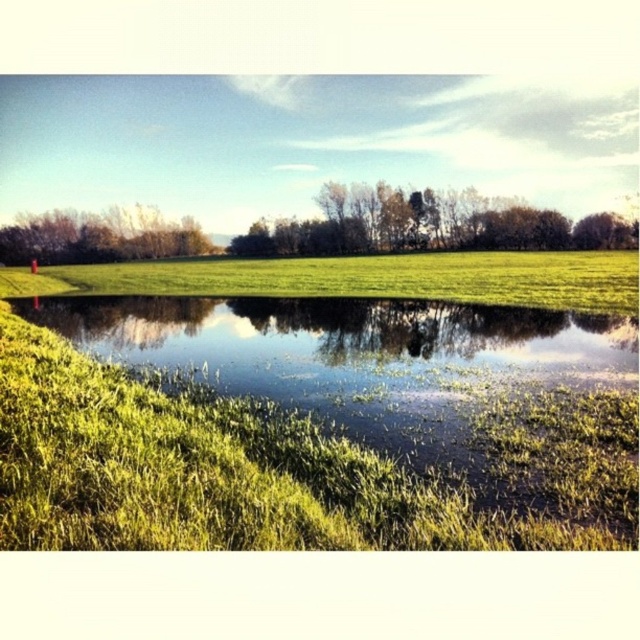
Question: Based on their relative distances, which object is nearer to the green leafy trees at center?

Choices:
 (A) green grassy field at center
 (B) brown leafy trees at upper left

Answer: (A)

Question: Is green grassy field at center smaller than brown leafy trees at upper left?

Choices:
 (A) yes
 (B) no

Answer: (B)

Question: Estimate the real-world distances between objects in this image. Which object is farther from the green leafy trees at center?

Choices:
 (A) green grassy field at center
 (B) brown leafy trees at upper left

Answer: (B)

Question: Based on their relative distances, which object is nearer to the brown leafy trees at upper left?

Choices:
 (A) green leafy trees at center
 (B) green grassy field at center

Answer: (A)

Question: Can you confirm if green grassy field at center is positioned below green leafy trees at center?

Choices:
 (A) no
 (B) yes

Answer: (B)

Question: Does green leafy trees at center have a lesser width compared to brown leafy trees at upper left?

Choices:
 (A) no
 (B) yes

Answer: (A)